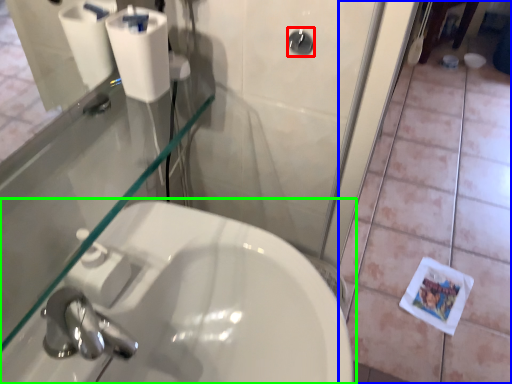
Question: Which object is positioned farthest from shower (highlighted by a red box)? Select from tile (highlighted by a blue box) and sink (highlighted by a green box).

Choices:
 (A) tile
 (B) sink

Answer: (A)